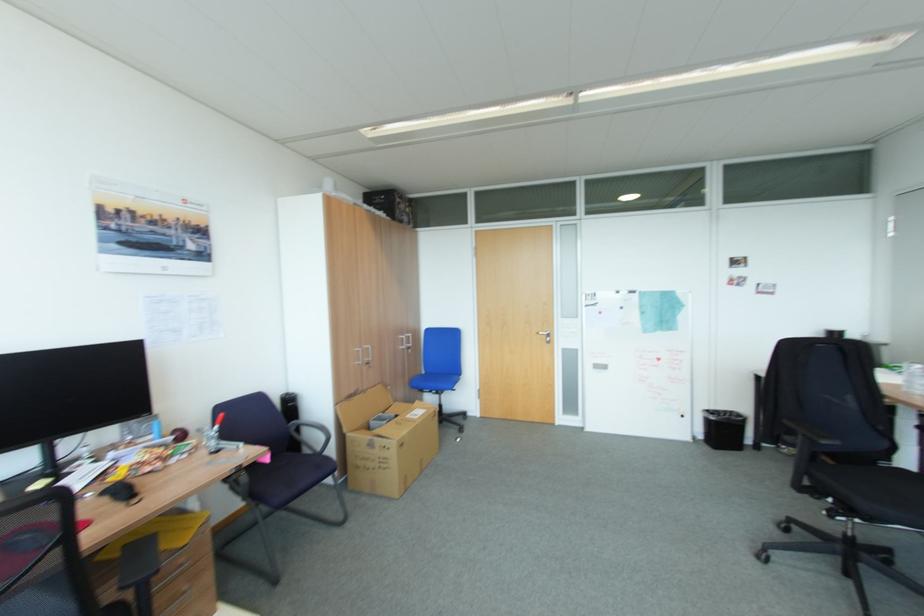
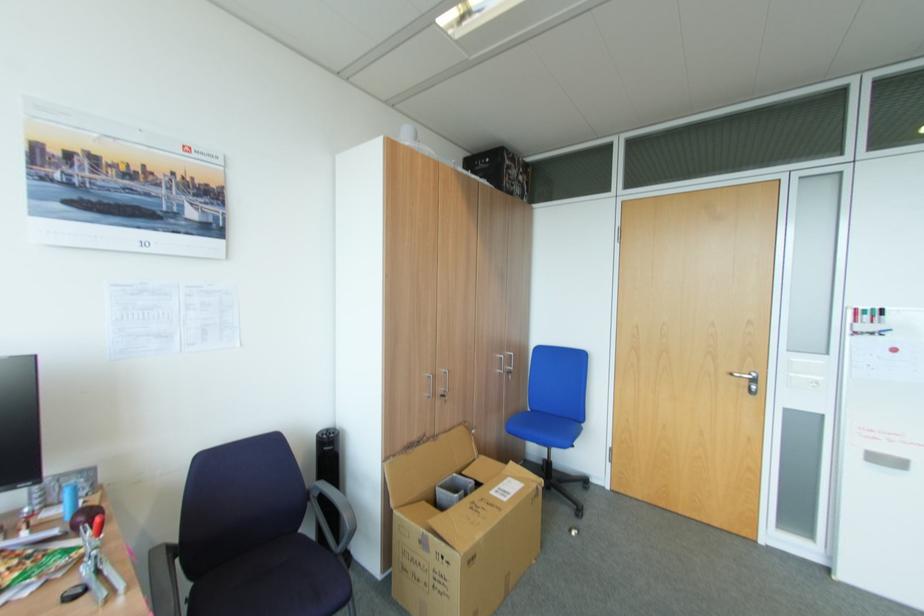
Find the pixel in the second image that matches [591,300] in the first image.

(861, 322)